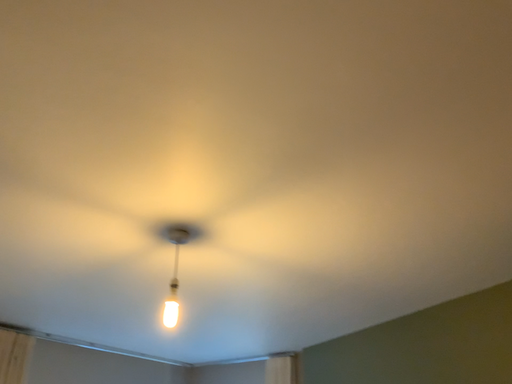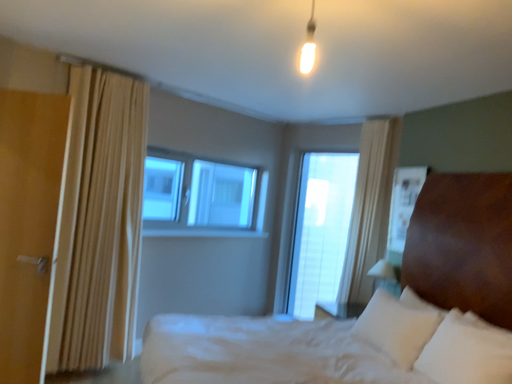
Question: Which way did the camera rotate in the video?

Choices:
 (A) rotated right
 (B) rotated left

Answer: (B)